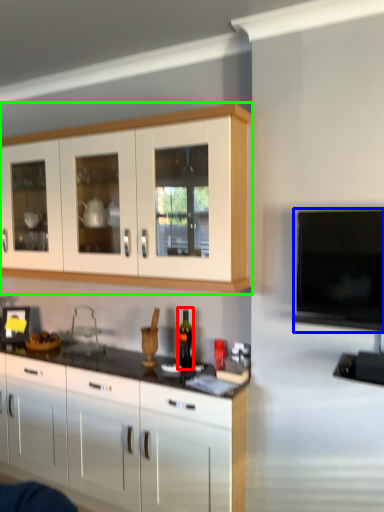
Question: Estimate the real-world distances between objects in this image. Which object is farther from bottle (highlighted by a red box), television (highlighted by a blue box) or cabinetry (highlighted by a green box)?

Choices:
 (A) television
 (B) cabinetry

Answer: (A)